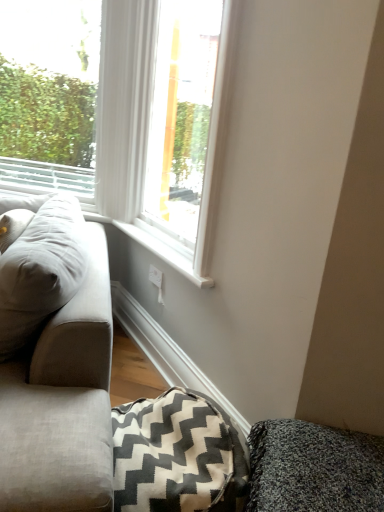
Question: Is white plastic window at upper left, acting as the second window starting from the right, smaller than gray zigzag-patterned blanket at lower center?

Choices:
 (A) yes
 (B) no

Answer: (B)

Question: Could you tell me if white plastic window at upper left, acting as the second window starting from the right, is facing gray zigzag-patterned blanket at lower center?

Choices:
 (A) no
 (B) yes

Answer: (A)

Question: Is white plastic window at upper left, acting as the second window starting from the right, positioned behind gray zigzag-patterned blanket at lower center?

Choices:
 (A) no
 (B) yes

Answer: (B)

Question: Is white plastic window at upper left, the 1th window viewed from the left, positioned with its back to gray zigzag-patterned blanket at lower center?

Choices:
 (A) no
 (B) yes

Answer: (A)

Question: Is gray zigzag-patterned blanket at lower center a part of white plastic window at upper left, acting as the second window starting from the right?

Choices:
 (A) yes
 (B) no

Answer: (B)

Question: Can you confirm if white plastic window at upper left, the 1th window viewed from the left, is taller than gray zigzag-patterned blanket at lower center?

Choices:
 (A) yes
 (B) no

Answer: (A)

Question: Is white painted wood at lower center positioned in front of white plastic window at upper left, the 1th window viewed from the left?

Choices:
 (A) yes
 (B) no

Answer: (A)

Question: Considering the relative positions of white painted wood at lower center and white plastic window at upper left, acting as the second window starting from the right, in the image provided, is white painted wood at lower center to the left of white plastic window at upper left, acting as the second window starting from the right, from the viewer's perspective?

Choices:
 (A) yes
 (B) no

Answer: (B)

Question: Is white painted wood at lower center thinner than white plastic window at upper left, the 1th window viewed from the left?

Choices:
 (A) yes
 (B) no

Answer: (A)

Question: From the image's perspective, is white painted wood at lower center above white plastic window at upper left, the 1th window viewed from the left?

Choices:
 (A) no
 (B) yes

Answer: (A)

Question: Is white plastic window at upper left, the 1th window viewed from the left, located within white painted wood at lower center?

Choices:
 (A) no
 (B) yes

Answer: (A)

Question: Is white painted wood at lower center far away from white plastic window at upper left, the 1th window viewed from the left?

Choices:
 (A) yes
 (B) no

Answer: (A)

Question: Is white glossy window at center, the second window when ordered from left to right, touching textured gray cushion at lower right?

Choices:
 (A) yes
 (B) no

Answer: (B)